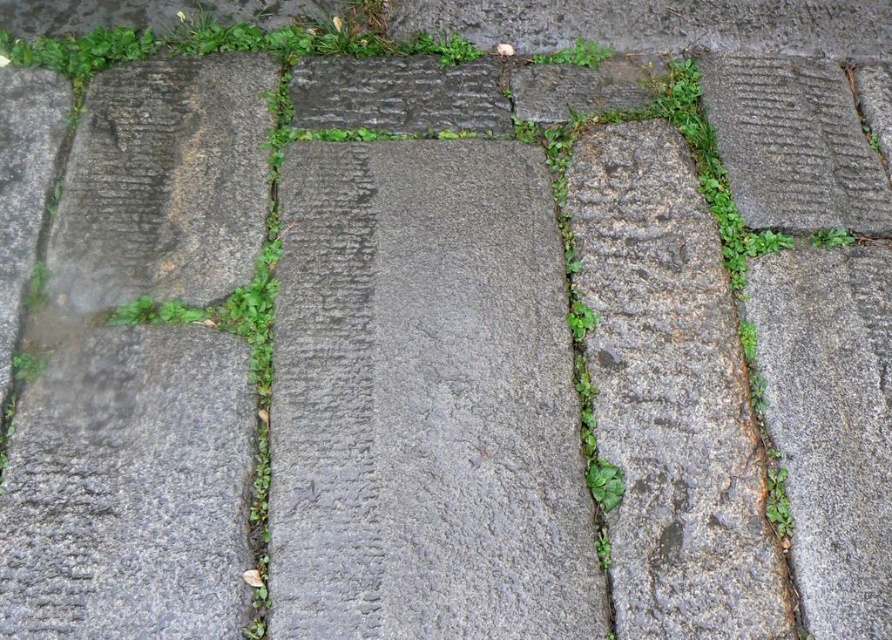
Is gray rough stone at center behind green leafy grass at upper center?

No.

In the scene shown: Which is below, gray rough stone at center or green leafy grass at upper center?

gray rough stone at center

Between point (506, 602) and point (581, 54), which one is positioned in front?

Point (506, 602) is in front.

Find the location of a particular element. gray rough stone at center is located at coordinates (425, 401).